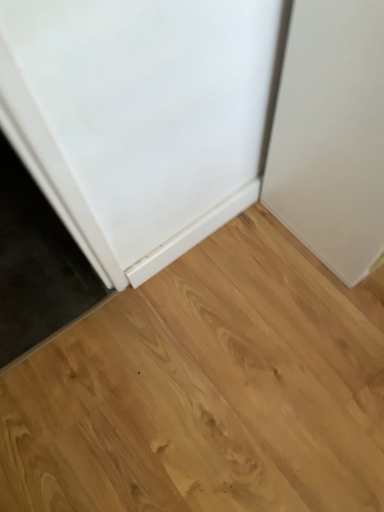
Find the location of a particular element. The height and width of the screenshot is (512, 384). vacant point above natural wood floor at center (from a real-world perspective) is located at coordinates (234, 382).